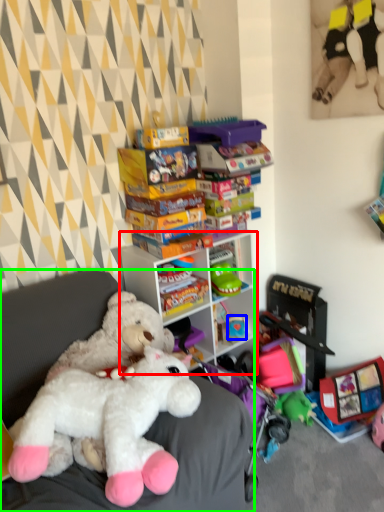
Question: Considering the real-world distances, which object is farthest from cabinetry (highlighted by a red box)? toy (highlighted by a blue box) or furniture (highlighted by a green box)?

Choices:
 (A) toy
 (B) furniture

Answer: (B)